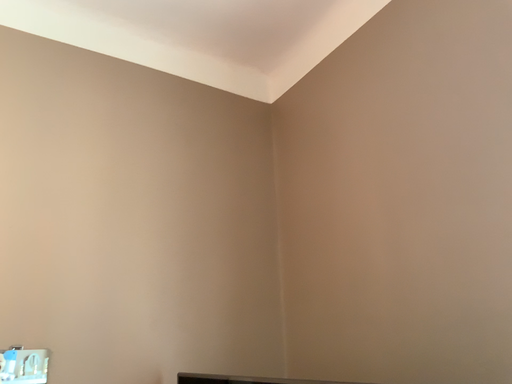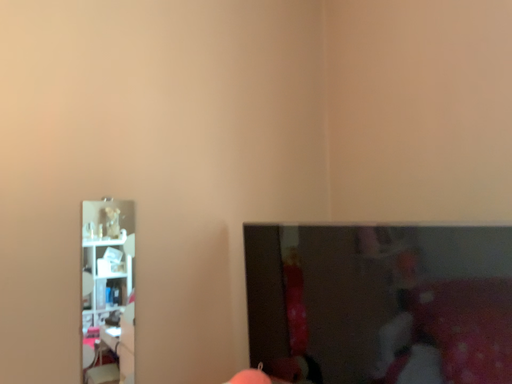
Question: Which way did the camera rotate in the video?

Choices:
 (A) rotated upward
 (B) rotated downward

Answer: (B)